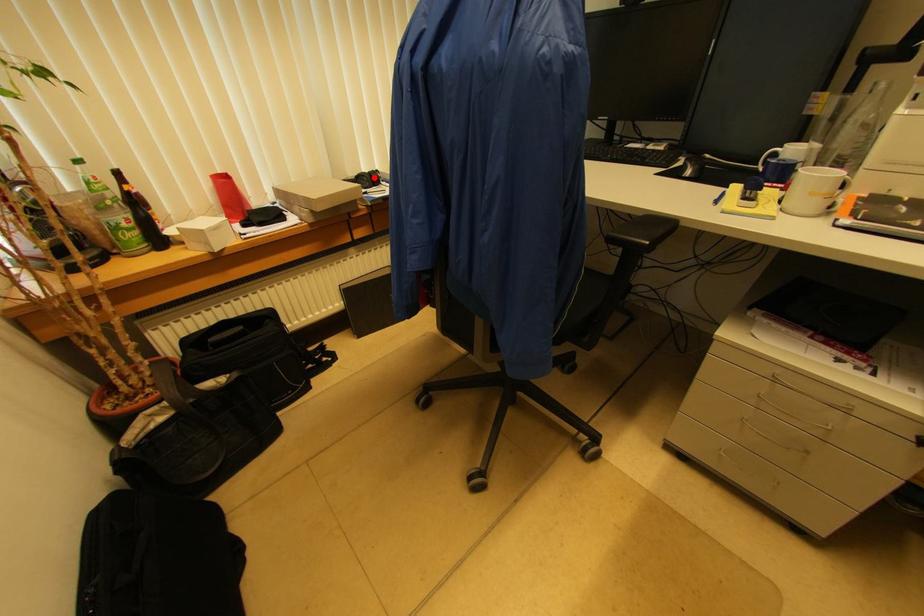
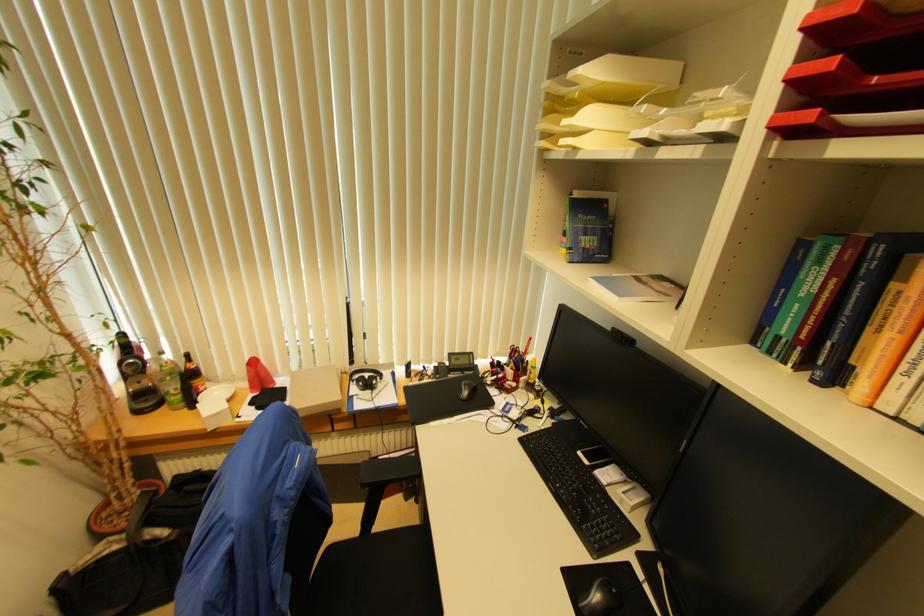
Where in the second image is the point corresponding to the highlighted location from the first image?

(371, 384)